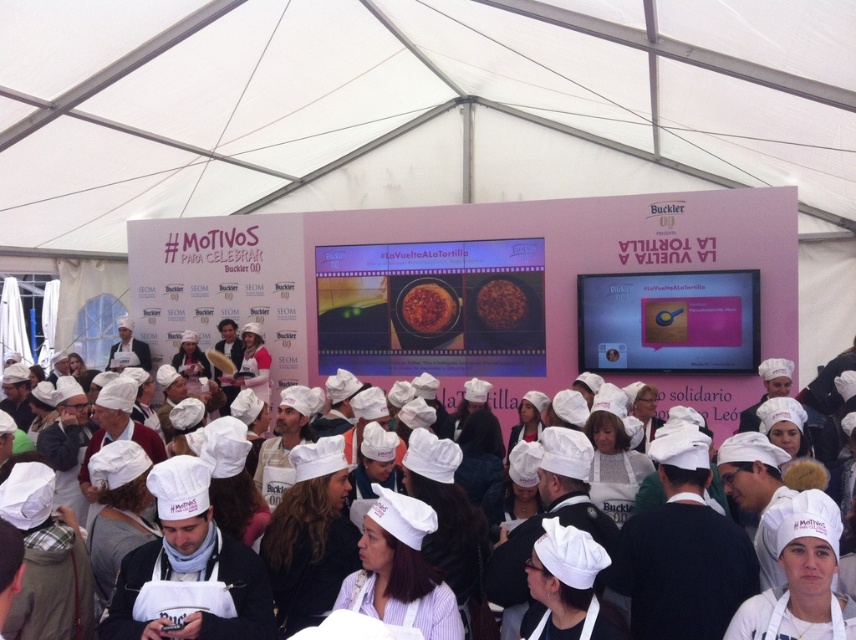
Between point (767, 378) and point (492, 289), which one is positioned in front?

Point (767, 378) is more forward.

Between white fabric chef hat at center and brown matte rice at center, which one has less height?

With less height is brown matte rice at center.

The image size is (856, 640). I want to click on white fabric chef hat at center, so click(x=742, y=488).

Does brown matte tortilla at center appear over brown matte rice at center?

Actually, brown matte tortilla at center is below brown matte rice at center.

Between brown matte tortilla at center and brown matte rice at center, which one is positioned higher?

Positioned higher is brown matte rice at center.

The height and width of the screenshot is (640, 856). In order to click on brown matte tortilla at center in this screenshot , I will do `click(428, 307)`.

In the scene shown: Is white fabric chef hat at center shorter than brown matte tortilla at center?

Incorrect, white fabric chef hat at center's height does not fall short of brown matte tortilla at center's.

The image size is (856, 640). What do you see at coordinates (742, 488) in the screenshot?
I see `white fabric chef hat at center` at bounding box center [742, 488].

The image size is (856, 640). Find the location of `white fabric chef hat at center`. white fabric chef hat at center is located at coordinates (742, 488).

You are a GUI agent. You are given a task and a screenshot of the screen. Output one action in this format:
    pyautogui.click(x=<x>, y=<y>)
    Task: Click on the white fabric chef hat at center
    
    Given the screenshot: What is the action you would take?
    pyautogui.click(x=742, y=488)